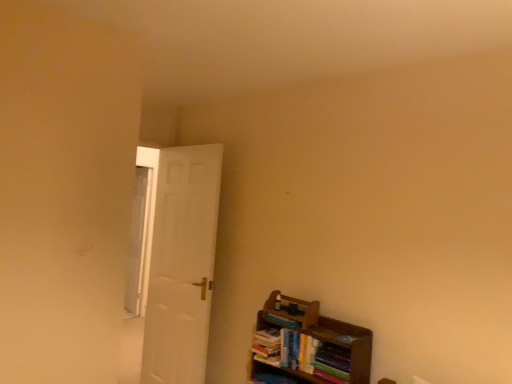
Question: From the image's perspective, does white matte door at left appear lower than hardcover books at lower right, acting as the 2th book starting from the top?

Choices:
 (A) no
 (B) yes

Answer: (A)

Question: Considering the relative sizes of white matte door at left and hardcover books at lower right, positioned as the 1th book in bottom-to-top order, in the image provided, is white matte door at left smaller than hardcover books at lower right, positioned as the 1th book in bottom-to-top order,?

Choices:
 (A) yes
 (B) no

Answer: (B)

Question: Can you confirm if white matte door at left is taller than hardcover books at lower right, acting as the 2th book starting from the top?

Choices:
 (A) yes
 (B) no

Answer: (A)

Question: Would you consider white matte door at left to be distant from hardcover books at lower right, acting as the 2th book starting from the top?

Choices:
 (A) yes
 (B) no

Answer: (A)

Question: Is white matte door at left looking in the opposite direction of hardcover books at lower right, positioned as the 1th book in bottom-to-top order?

Choices:
 (A) no
 (B) yes

Answer: (A)

Question: In terms of width, does hardcover books at lower right, positioned as the 1th book in bottom-to-top order, look wider or thinner when compared to wooden bookshelf at lower right?

Choices:
 (A) thin
 (B) wide

Answer: (A)

Question: Visually, is hardcover books at lower right, positioned as the 1th book in bottom-to-top order, positioned to the left or to the right of wooden bookshelf at lower right?

Choices:
 (A) right
 (B) left

Answer: (B)

Question: From a real-world perspective, is hardcover books at lower right, positioned as the 1th book in bottom-to-top order, positioned above or below wooden bookshelf at lower right?

Choices:
 (A) below
 (B) above

Answer: (B)

Question: Is hardcover books at lower right, positioned as the 1th book in bottom-to-top order, inside the boundaries of wooden bookshelf at lower right, or outside?

Choices:
 (A) inside
 (B) outside

Answer: (A)

Question: From a real-world perspective, relative to hardcover book at lower right, the 1th book positioned from the top, is wooden bookshelf at lower right vertically above or below?

Choices:
 (A) above
 (B) below

Answer: (B)

Question: From the image's perspective, is wooden bookshelf at lower right located above or below hardcover book at lower right, the 1th book positioned from the top?

Choices:
 (A) above
 (B) below

Answer: (B)

Question: Based on their sizes in the image, would you say wooden bookshelf at lower right is bigger or smaller than hardcover book at lower right, the 1th book positioned from the top?

Choices:
 (A) small
 (B) big

Answer: (B)

Question: Considering the positions of wooden bookshelf at lower right and hardcover book at lower right, the 1th book positioned from the top, in the image, is wooden bookshelf at lower right wider or thinner than hardcover book at lower right, the 1th book positioned from the top,?

Choices:
 (A) wide
 (B) thin

Answer: (A)

Question: Looking at their shapes, would you say clear glass window at left is wider or thinner than hardcover books at lower right, acting as the 2th book starting from the top?

Choices:
 (A) wide
 (B) thin

Answer: (B)

Question: Considering the positions of clear glass window at left and hardcover books at lower right, acting as the 2th book starting from the top, in the image, is clear glass window at left bigger or smaller than hardcover books at lower right, acting as the 2th book starting from the top,?

Choices:
 (A) big
 (B) small

Answer: (A)